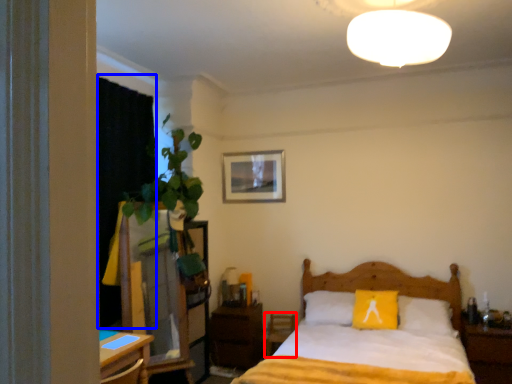
Question: Which object appears closest to the camera in this image, armchair (highlighted by a red box) or curtain (highlighted by a blue box)?

Choices:
 (A) armchair
 (B) curtain

Answer: (B)